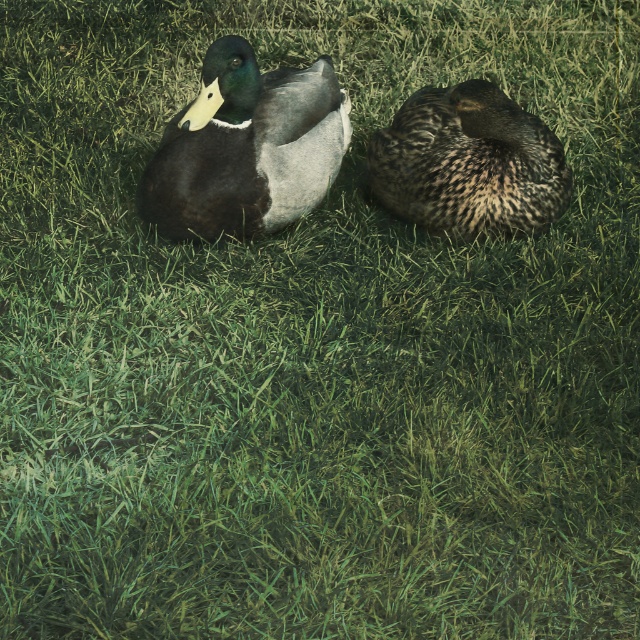
Who is more distant from viewer, (182, 214) or (486, 138)?

Point (486, 138)

Between point (250, 67) and point (476, 157), which one is positioned in front?

Point (250, 67)

What are the coordinates of `shiny green duck at upper left` in the screenshot? It's located at (246, 147).